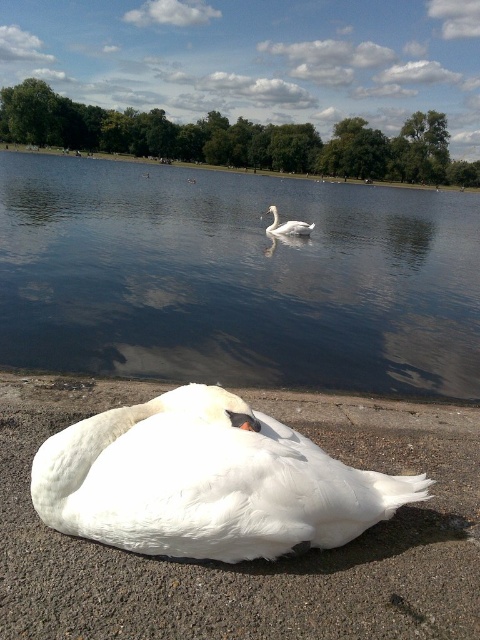
You are standing at the lakeside and want to take a photo of the two points in the scene. Which point, point (119,385) or point (300,234), will appear larger in your camera view?

Point (119,385) is closer to the camera than point (300,234), so it will appear larger in the camera view.

You are an ornithologist observing the scene. You need to determine which object occupies more space in the image between the glossy water at center and the white feathered swan at lower center. Which one is it?

The glossy water at center has a larger size compared to the white feathered swan at lower center, so the glossy water at center occupies more space in the image.

You are standing at the edge of the lake and want to reach the two points marked in the scene. Which point, point (148, 509) or point (59, 372), is closer to you?

Point (148, 509) is closer to the viewer than point (59, 372).